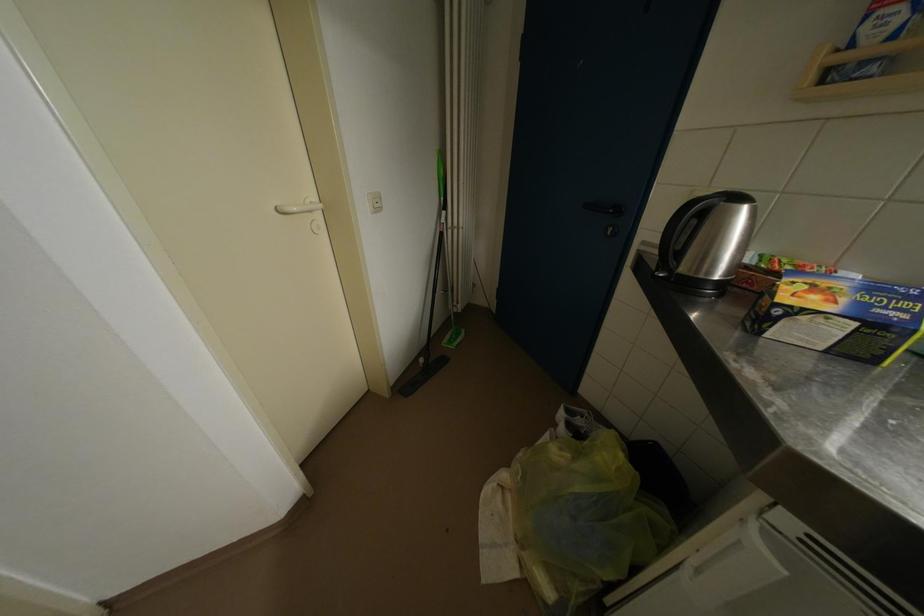
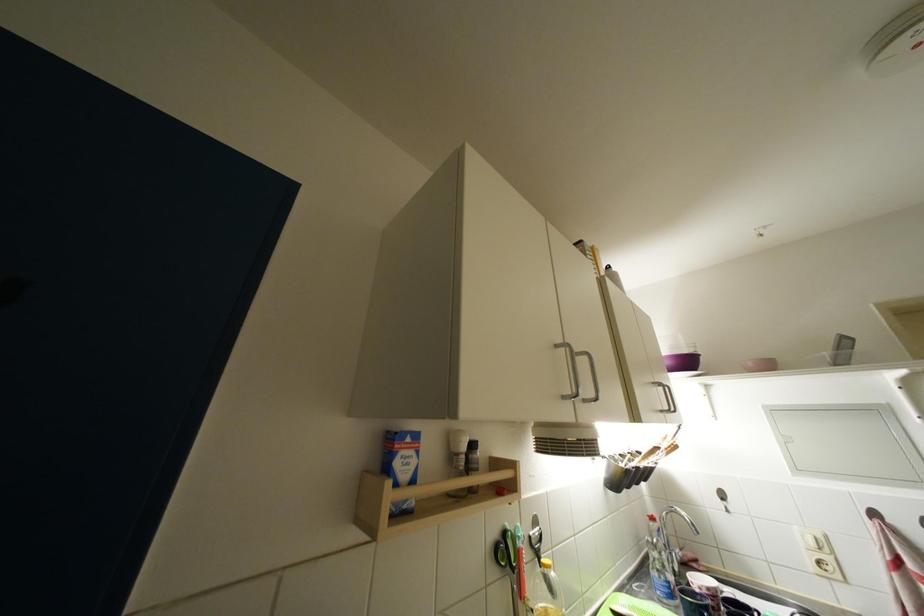
In the second image, find the point that corresponds to (x=874, y=30) in the first image.

(404, 467)